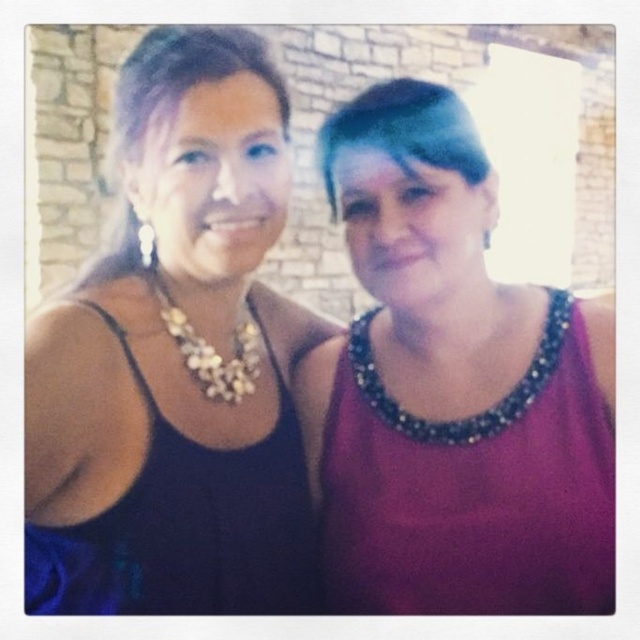
Question: Is purple beaded tank top at right below dark blue satin dress at left?

Choices:
 (A) yes
 (B) no

Answer: (B)

Question: Can you confirm if dark blue satin dress at left is positioned below pearl and glass necklace at center?

Choices:
 (A) no
 (B) yes

Answer: (B)

Question: Can you confirm if purple beaded tank top at right is positioned to the right of gold metallic necklace at upper center?

Choices:
 (A) yes
 (B) no

Answer: (A)

Question: Which point appears farthest from the camera in this image?

Choices:
 (A) (365, 467)
 (B) (252, 563)

Answer: (A)

Question: Among these objects, which one is nearest to the camera?

Choices:
 (A) gold metallic necklace at upper center
 (B) dark blue satin dress at left
 (C) pearl and glass necklace at center

Answer: (B)

Question: Which of these objects is positioned farthest from the gold metallic necklace at upper center?

Choices:
 (A) purple beaded tank top at right
 (B) dark blue satin dress at left
 (C) pearl and glass necklace at center

Answer: (A)